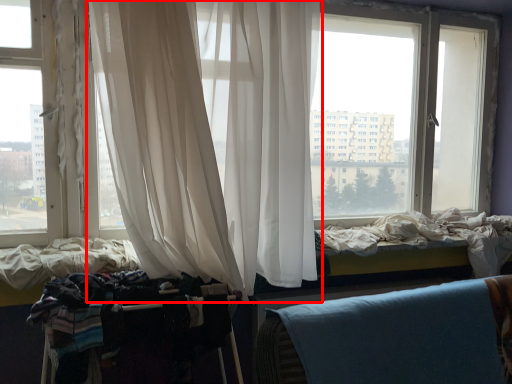
Question: From the image's perspective, what is the correct spatial relationship of curtain (annotated by the red box) in relation to baby carriage?

Choices:
 (A) above
 (B) below

Answer: (A)